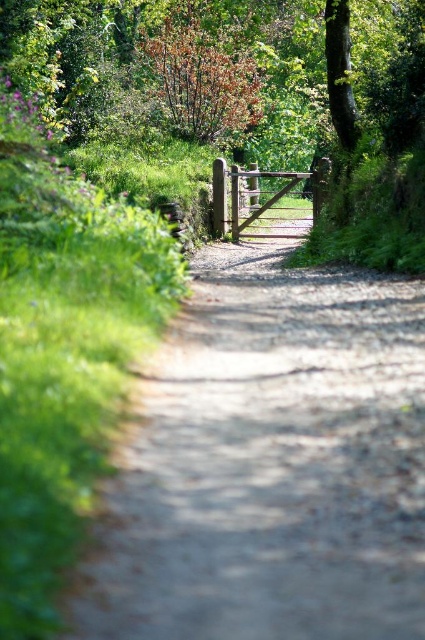
Can you confirm if dirt/gravel path at center is thinner than brown textured tree at upper center?

Incorrect, dirt/gravel path at center's width is not less than brown textured tree at upper center's.

Is point (252, 616) positioned after point (161, 74)?

No, it is not.

Where is `dirt/gravel path at center`? dirt/gravel path at center is located at coordinates (269, 465).